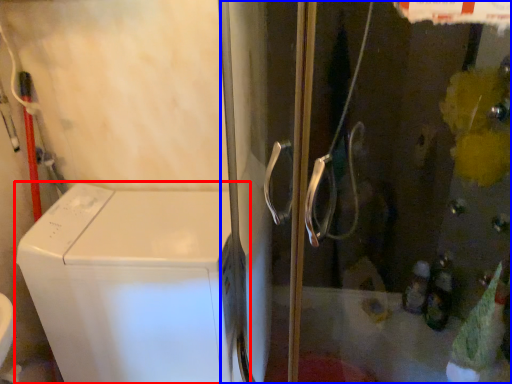
Question: Which point is closer to the camera, home appliance (highlighted by a red box) or screen door (highlighted by a blue box)?

Choices:
 (A) home appliance
 (B) screen door

Answer: (B)